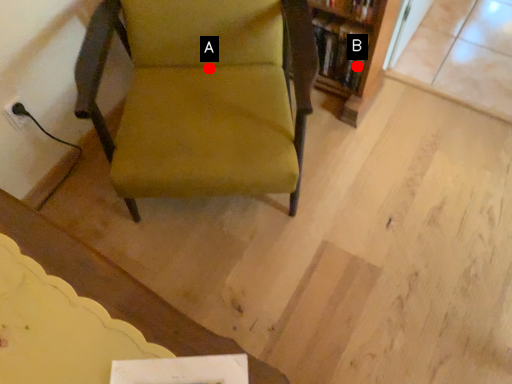
Question: Two points are circled on the image, labeled by A and B beside each circle. Which point is closer to the camera?

Choices:
 (A) A is closer
 (B) B is closer

Answer: (A)